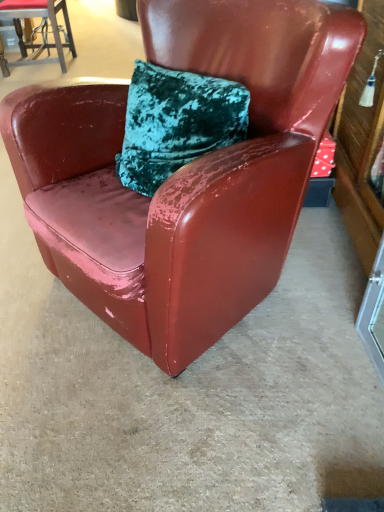
Question: Can glossy leather chair at upper left, the first chair in the left-to-right sequence, be found inside transparent glass door at lower right?

Choices:
 (A) yes
 (B) no

Answer: (B)

Question: Is glossy leather chair at upper left, the 2th chair when ordered from front to back, at the back of transparent glass door at lower right?

Choices:
 (A) no
 (B) yes

Answer: (A)

Question: Is transparent glass door at lower right at the right side of glossy leather chair at upper left, the 2th chair when ordered from front to back?

Choices:
 (A) no
 (B) yes

Answer: (B)

Question: Is transparent glass door at lower right next to glossy leather chair at upper left, which is the 1th chair from top to bottom, and touching it?

Choices:
 (A) no
 (B) yes

Answer: (A)

Question: Can you confirm if transparent glass door at lower right is shorter than glossy leather chair at upper left, the 2th chair when ordered from front to back?

Choices:
 (A) no
 (B) yes

Answer: (B)

Question: From the image's perspective, is glossy leather chair at upper left, the first chair in the back-to-front sequence, above or below glossy leather chair at center, acting as the 1th chair starting from the front?

Choices:
 (A) above
 (B) below

Answer: (A)

Question: From a real-world perspective, relative to glossy leather chair at center, arranged as the 2th chair when viewed from the left, is glossy leather chair at upper left, the first chair in the left-to-right sequence, vertically above or below?

Choices:
 (A) above
 (B) below

Answer: (B)

Question: Is glossy leather chair at upper left, the 2th chair when ordered from bottom to top, situated inside glossy leather chair at center, which is counted as the 1th chair, starting from the right, or outside?

Choices:
 (A) inside
 (B) outside

Answer: (B)

Question: Looking at their shapes, would you say glossy leather chair at upper left, the 2th chair when ordered from front to back, is wider or thinner than glossy leather chair at center, acting as the 1th chair starting from the front?

Choices:
 (A) thin
 (B) wide

Answer: (A)

Question: Looking at their shapes, would you say glossy leather chair at center, acting as the 1th chair starting from the front, is wider or thinner than transparent glass door at lower right?

Choices:
 (A) thin
 (B) wide

Answer: (B)

Question: From a real-world perspective, is glossy leather chair at center, acting as the 2th chair starting from the back, positioned above or below transparent glass door at lower right?

Choices:
 (A) above
 (B) below

Answer: (A)

Question: Looking at the image, does glossy leather chair at center, the 1th chair when ordered from bottom to top, seem bigger or smaller compared to transparent glass door at lower right?

Choices:
 (A) big
 (B) small

Answer: (A)

Question: In the image, is glossy leather chair at center, the 2th chair when ordered from top to bottom, on the left side or the right side of transparent glass door at lower right?

Choices:
 (A) left
 (B) right

Answer: (A)

Question: From their relative heights in the image, would you say transparent glass door at lower right is taller or shorter than glossy leather chair at center, the 1th chair when ordered from bottom to top?

Choices:
 (A) tall
 (B) short

Answer: (B)

Question: From the image's perspective, is transparent glass door at lower right located above or below glossy leather chair at center, the 1th chair when ordered from bottom to top?

Choices:
 (A) above
 (B) below

Answer: (B)